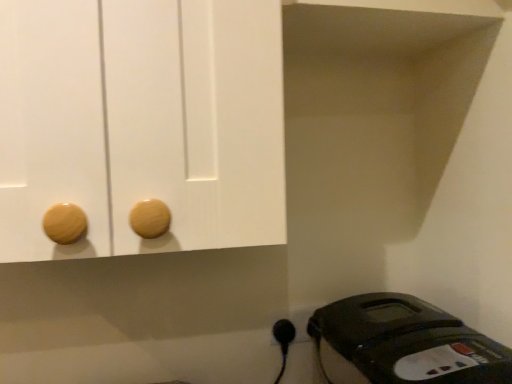
This screenshot has width=512, height=384. What do you see at coordinates (298, 322) in the screenshot?
I see `black plastic outlet at lower right` at bounding box center [298, 322].

Image resolution: width=512 pixels, height=384 pixels. Describe the element at coordinates (284, 332) in the screenshot. I see `black plastic plug at lower right` at that location.

The width and height of the screenshot is (512, 384). What are the coordinates of `black plastic outlet at lower right` in the screenshot? It's located at (298, 322).

In the image, there is a black plastic outlet at lower right. Where is `plug below it (from a real-world perspective)`? Image resolution: width=512 pixels, height=384 pixels. plug below it (from a real-world perspective) is located at coordinates (284, 332).

From a real-world perspective, between black plastic outlet at lower right and black plastic plug at lower right, who is vertically higher?

From a 3D spatial view, black plastic outlet at lower right is above.

Is black plastic plug at lower right turned away from black plastic iron at lower right?

No, black plastic plug at lower right is not facing the opposite direction of black plastic iron at lower right.

Who is more distant, black plastic plug at lower right or black plastic iron at lower right?

black plastic plug at lower right is further from the camera.

From the image's perspective, who appears lower, black plastic plug at lower right or black plastic iron at lower right?

black plastic iron at lower right is shown below in the image.

In the scene shown: From a real-world perspective, which object stands above the other?

black plastic plug at lower right, from a real-world perspective.

How different are the orientations of black plastic iron at lower right and black plastic outlet at lower right in degrees?

black plastic iron at lower right and black plastic outlet at lower right are facing 91 degrees away from each other.

Is black plastic iron at lower right oriented towards black plastic outlet at lower right?

No, black plastic iron at lower right is not aimed at black plastic outlet at lower right.

Based on the photo, is the position of black plastic iron at lower right less distant than that of black plastic outlet at lower right?

Yes, the depth of black plastic iron at lower right is less than that of black plastic outlet at lower right.

How distant is black plastic iron at lower right from black plastic outlet at lower right?

23.18 centimeters.

Considering the points (304, 319) and (371, 369), which point is behind, point (304, 319) or point (371, 369)?

The point (304, 319) is farther.

From the picture: Which of these two, black plastic outlet at lower right or black plastic iron at lower right, is smaller?

Smaller between the two is black plastic outlet at lower right.

From the image's perspective, would you say black plastic outlet at lower right is shown under black plastic iron at lower right?

No, from the image's perspective, black plastic outlet at lower right is not beneath black plastic iron at lower right.

Considering the sizes of black plastic iron at lower right and black plastic plug at lower right in the image, is black plastic iron at lower right bigger or smaller than black plastic plug at lower right?

In the image, black plastic iron at lower right appears to be larger than black plastic plug at lower right.

From the image's perspective, relative to black plastic plug at lower right, is black plastic iron at lower right above or below?

Clearly, from the image's perspective, black plastic iron at lower right is below black plastic plug at lower right.

Image resolution: width=512 pixels, height=384 pixels. What are the coordinates of `home appliance in front of the black plastic plug at lower right` in the screenshot? It's located at (403, 344).

Consider the image. How many degrees apart are the facing directions of black plastic iron at lower right and black plastic plug at lower right?

The angular difference between black plastic iron at lower right and black plastic plug at lower right is 91 degrees.

From the image's perspective, between black plastic plug at lower right and black plastic outlet at lower right, who is located below?

black plastic plug at lower right, from the image's perspective.

Is black plastic plug at lower right facing away from black plastic outlet at lower right?

Yes, black plastic plug at lower right's orientation is away from black plastic outlet at lower right.

Looking at this image, between black plastic plug at lower right and black plastic outlet at lower right, which one has more height?

Standing taller between the two is black plastic outlet at lower right.

In the scene shown: Which object is positioned more to the left, black plastic plug at lower right or black plastic outlet at lower right?

From the viewer's perspective, black plastic plug at lower right appears more on the left side.

Where is `electric outlet on the right of black plastic plug at lower right`? The height and width of the screenshot is (384, 512). electric outlet on the right of black plastic plug at lower right is located at coordinates (298, 322).

The height and width of the screenshot is (384, 512). I want to click on plug located behind the black plastic iron at lower right, so click(284, 332).

From the image, which object appears to be farther from black plastic outlet at lower right, black plastic iron at lower right or black plastic plug at lower right?

black plastic iron at lower right is positioned further to the anchor black plastic outlet at lower right.

Estimate the real-world distances between objects in this image. Which object is further from black plastic outlet at lower right, black plastic plug at lower right or black plastic iron at lower right?

black plastic iron at lower right is further to black plastic outlet at lower right.

Estimate the real-world distances between objects in this image. Which object is closer to black plastic plug at lower right, black plastic outlet at lower right or black plastic iron at lower right?

black plastic outlet at lower right.

Which object lies nearer to the anchor point black plastic iron at lower right, black plastic plug at lower right or black plastic outlet at lower right?

black plastic outlet at lower right is positioned closer to the anchor black plastic iron at lower right.

Considering their positions, is black plastic iron at lower right positioned closer to black plastic plug at lower right than black plastic outlet at lower right?

The object closer to black plastic plug at lower right is black plastic outlet at lower right.

Based on their spatial positions, is black plastic outlet at lower right or black plastic plug at lower right further from black plastic iron at lower right?

The object further to black plastic iron at lower right is black plastic plug at lower right.

Locate an element on the screen. plug between black plastic iron at lower right and black plastic outlet at lower right along the z-axis is located at coordinates (284, 332).